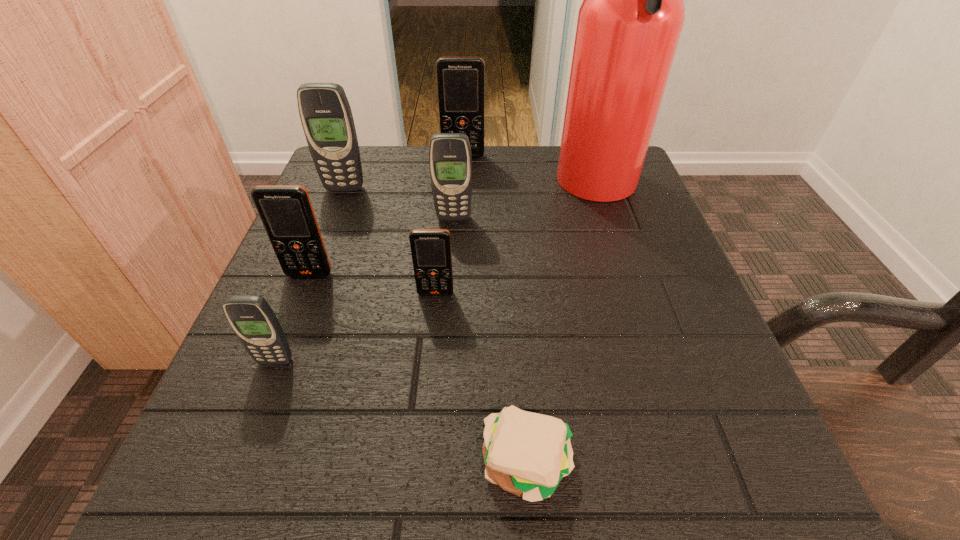
You are a GUI agent. You are given a task and a screenshot of the screen. Output one action in this format:
    pyautogui.click(x=<x>, y=<y>)
    Task: Click on the second closest orange cellular telephone to the nearest cellular telephone
    Image resolution: width=960 pixels, height=540 pixels.
    Given the screenshot: What is the action you would take?
    pyautogui.click(x=430, y=248)

I want to click on gray cellular telephone object that ranks as the second closest to the fourth nearest cellular telephone, so click(x=252, y=319).

You are a GUI agent. You are given a task and a screenshot of the screen. Output one action in this format:
    pyautogui.click(x=<x>, y=<y>)
    Task: Click on the third closest gray cellular telephone to the sixth farthest object
    Image resolution: width=960 pixels, height=540 pixels.
    Given the screenshot: What is the action you would take?
    pyautogui.click(x=326, y=116)